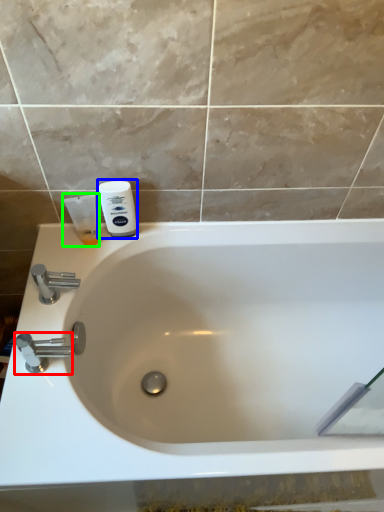
Question: Based on their relative distances, which object is nearer to tap (highlighted by a red box)? Choose from shaving cream (highlighted by a blue box) and shaving cream (highlighted by a green box).

Choices:
 (A) shaving cream
 (B) shaving cream

Answer: (B)